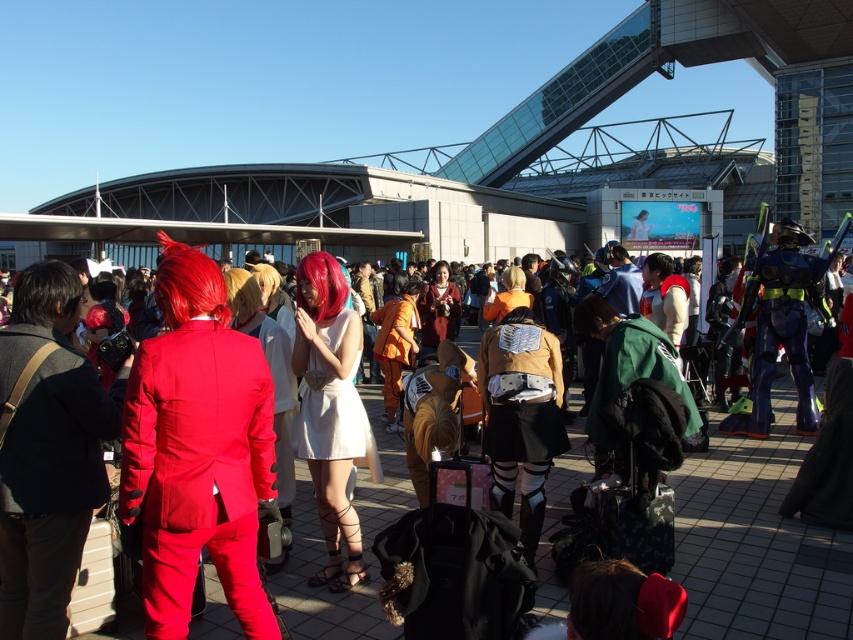
Question: Which point appears farthest from the camera in this image?

Choices:
 (A) (450, 273)
 (B) (386, 392)
 (C) (537, 369)
 (D) (263, 470)

Answer: (A)

Question: Which object appears farthest from the camera in this image?

Choices:
 (A) shiny red suit at left
 (B) white satin dress at center
 (C) matte red suit at center
 (D) brown leather jacket at center

Answer: (B)

Question: Is matte red suit at center to the right of orange fabric pants at center from the viewer's perspective?

Choices:
 (A) yes
 (B) no

Answer: (B)

Question: Among these objects, which one is nearest to the camera?

Choices:
 (A) matte brown coat at center
 (B) orange fabric pants at center
 (C) white satin dress at center

Answer: (C)

Question: Does white satin dress at center have a larger size compared to matte brown coat at center?

Choices:
 (A) no
 (B) yes

Answer: (A)

Question: Is matte red suit at center to the right of shiny red suit at left from the viewer's perspective?

Choices:
 (A) no
 (B) yes

Answer: (B)